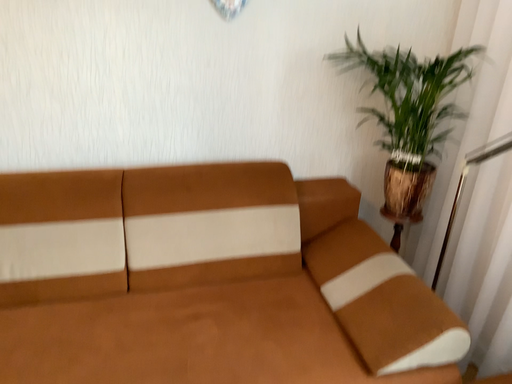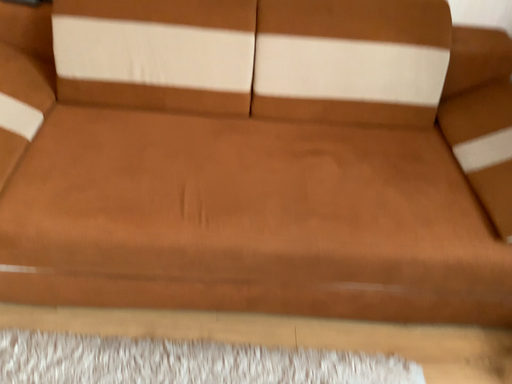
Question: How did the camera likely rotate when shooting the video?

Choices:
 (A) rotated left
 (B) rotated right

Answer: (A)